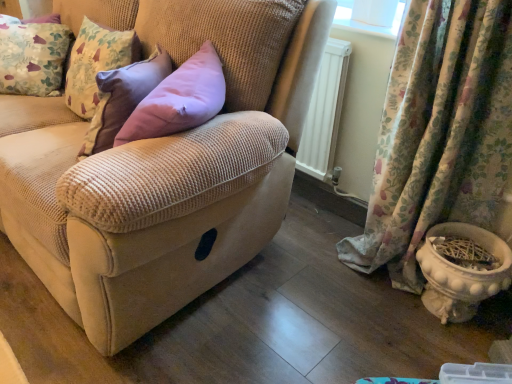
The height and width of the screenshot is (384, 512). I want to click on floral fabric curtain at lower right, so click(x=439, y=133).

Locate an element on the screen. white glossy flowerpot at lower right is located at coordinates (461, 274).

Consider the image. Measure the distance between beige corduroy couch at center and camera.

beige corduroy couch at center is 91.76 centimeters away from camera.

This screenshot has height=384, width=512. Find the location of `floral fabric curtain at lower right`. floral fabric curtain at lower right is located at coordinates (439, 133).

In the scene shown: Is beige corduroy couch at center to the left or to the right of floral fabric cushion at upper left in the image?

beige corduroy couch at center is to the right of floral fabric cushion at upper left.

Could you tell me if beige corduroy couch at center is turned towards floral fabric cushion at upper left?

Yes, beige corduroy couch at center is oriented towards floral fabric cushion at upper left.

Is point (13, 215) farther from camera compared to point (0, 48)?

No, it is in front of (0, 48).

Is white glossy flowerpot at lower right facing away from floral fabric curtain at lower right?

Yes, white glossy flowerpot at lower right's orientation is away from floral fabric curtain at lower right.

Is white glossy flowerpot at lower right spatially inside floral fabric curtain at lower right, or outside of it?

white glossy flowerpot at lower right is contained in floral fabric curtain at lower right.

Looking at this image, based on their sizes in the image, would you say white glossy flowerpot at lower right is bigger or smaller than floral fabric curtain at lower right?

white glossy flowerpot at lower right is smaller than floral fabric curtain at lower right.

Between white glossy flowerpot at lower right and floral fabric curtain at lower right, which one has smaller width?

With smaller width is floral fabric curtain at lower right.

Who is bigger, floral fabric cushion at upper left or white glossy flowerpot at lower right?

Bigger between the two is floral fabric cushion at upper left.

Is white glossy flowerpot at lower right inside floral fabric cushion at upper left?

No, floral fabric cushion at upper left does not contain white glossy flowerpot at lower right.

From their relative heights in the image, would you say floral fabric cushion at upper left is taller or shorter than white glossy flowerpot at lower right?

floral fabric cushion at upper left is taller than white glossy flowerpot at lower right.

Which point is more distant from viewer, (15, 51) or (443, 269)?

The point (15, 51) is behind.

Based on their positions, is beige corduroy couch at center located to the left or right of floral fabric curtain at lower right?

From the image, it's evident that beige corduroy couch at center is to the left of floral fabric curtain at lower right.

Would you say beige corduroy couch at center is a long distance from floral fabric curtain at lower right?

beige corduroy couch at center is near floral fabric curtain at lower right, not far away.

Is beige corduroy couch at center positioned behind floral fabric curtain at lower right?

No, beige corduroy couch at center is closer to the camera.

Based on their sizes in the image, would you say beige corduroy couch at center is bigger or smaller than floral fabric curtain at lower right?

In the image, beige corduroy couch at center appears to be larger than floral fabric curtain at lower right.

From a real-world perspective, which is physically below, white glossy flowerpot at lower right or floral fabric cushion at upper left?

white glossy flowerpot at lower right, from a real-world perspective.

Which is behind, white glossy flowerpot at lower right or floral fabric cushion at upper left?

floral fabric cushion at upper left is behind.

Is floral fabric cushion at upper left a part of white glossy flowerpot at lower right?

Definitely not — floral fabric cushion at upper left is not inside white glossy flowerpot at lower right.

Between white glossy flowerpot at lower right and floral fabric cushion at upper left, which one appears on the left side from the viewer's perspective?

Positioned to the left is floral fabric cushion at upper left.

Would you say floral fabric cushion at upper left is a long distance from beige corduroy couch at center?

floral fabric cushion at upper left is near beige corduroy couch at center, not far away.

From a real-world perspective, does floral fabric cushion at upper left stand above beige corduroy couch at center?

Indeed, from a real-world perspective, floral fabric cushion at upper left stands above beige corduroy couch at center.

Considering the positions of point (9, 51) and point (150, 156), is point (9, 51) closer or farther from the camera than point (150, 156)?

Clearly, point (9, 51) is more distant from the camera than point (150, 156).

Is floral fabric cushion at upper left aimed at beige corduroy couch at center?

Yes, floral fabric cushion at upper left is facing beige corduroy couch at center.

What's the angular difference between floral fabric curtain at lower right and beige corduroy couch at center's facing directions?

The angular difference between floral fabric curtain at lower right and beige corduroy couch at center is 0.695 degrees.

In the scene shown: Would you say floral fabric curtain at lower right is inside or outside beige corduroy couch at center?

floral fabric curtain at lower right is located beyond the bounds of beige corduroy couch at center.

Considering the relative sizes of floral fabric curtain at lower right and beige corduroy couch at center in the image provided, is floral fabric curtain at lower right shorter than beige corduroy couch at center?

Yes, floral fabric curtain at lower right is shorter than beige corduroy couch at center.

In the scene shown: Can you see floral fabric curtain at lower right touching beige corduroy couch at center?

No.

At what (x,y) coordinates should I click in order to perform the action: click on pillow behind the beige corduroy couch at center. Please return your answer as a coordinate pair (x, y). This screenshot has height=384, width=512. Looking at the image, I should click on (32, 56).

This screenshot has width=512, height=384. What are the coordinates of `flowerpot that appears below the floral fabric curtain at lower right (from the image's perspective)` in the screenshot? It's located at (461, 274).

Looking at the image, which one is located further to white glossy flowerpot at lower right, floral fabric curtain at lower right or floral fabric cushion at upper left?

The object further to white glossy flowerpot at lower right is floral fabric cushion at upper left.

Considering their positions, is beige corduroy couch at center positioned closer to white glossy flowerpot at lower right than floral fabric curtain at lower right?

floral fabric curtain at lower right.

Estimate the real-world distances between objects in this image. Which object is closer to floral fabric cushion at upper left, floral fabric curtain at lower right or beige corduroy couch at center?

beige corduroy couch at center.

Considering their positions, is white glossy flowerpot at lower right positioned further to beige corduroy couch at center than floral fabric curtain at lower right?

white glossy flowerpot at lower right lies further to beige corduroy couch at center than the other object.

Which object lies nearer to the anchor point floral fabric cushion at upper left, white glossy flowerpot at lower right or floral fabric curtain at lower right?

Based on the image, floral fabric curtain at lower right appears to be nearer to floral fabric cushion at upper left.

Based on their spatial positions, is floral fabric cushion at upper left or floral fabric curtain at lower right closer to beige corduroy couch at center?

floral fabric curtain at lower right is closer to beige corduroy couch at center.

Which object lies nearer to the anchor point floral fabric cushion at upper left, white glossy flowerpot at lower right or beige corduroy couch at center?

beige corduroy couch at center.

When comparing their distances from floral fabric curtain at lower right, does white glossy flowerpot at lower right or beige corduroy couch at center seem further?

beige corduroy couch at center is positioned further to the anchor floral fabric curtain at lower right.

Image resolution: width=512 pixels, height=384 pixels. Find the location of `curtain between floral fabric cushion at upper left and white glossy flowerpot at lower right from left to right`. curtain between floral fabric cushion at upper left and white glossy flowerpot at lower right from left to right is located at coordinates (439, 133).

The image size is (512, 384). Find the location of `studio couch between floral fabric cushion at upper left and floral fabric curtain at lower right from left to right`. studio couch between floral fabric cushion at upper left and floral fabric curtain at lower right from left to right is located at coordinates (163, 174).

Image resolution: width=512 pixels, height=384 pixels. Find the location of `curtain situated between beige corduroy couch at center and white glossy flowerpot at lower right from left to right`. curtain situated between beige corduroy couch at center and white glossy flowerpot at lower right from left to right is located at coordinates (439, 133).

Locate an element on the screen. This screenshot has height=384, width=512. studio couch between floral fabric cushion at upper left and white glossy flowerpot at lower right in the horizontal direction is located at coordinates (163, 174).